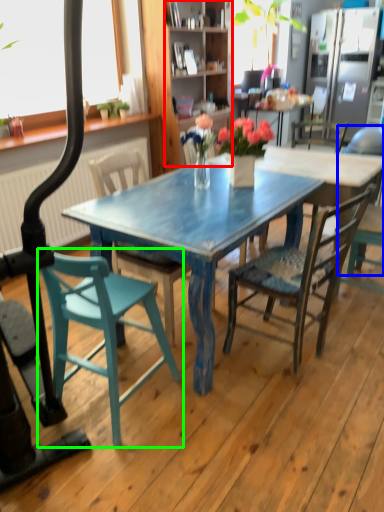
Question: Estimate the real-world distances between objects in this image. Which object is farther from cabinetry (highlighted by a red box), chair (highlighted by a blue box) or chair (highlighted by a green box)?

Choices:
 (A) chair
 (B) chair

Answer: (B)